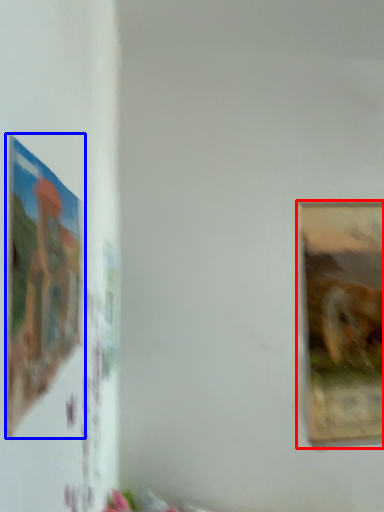
Question: Which object is further to the camera taking this photo, picture frame (highlighted by a red box) or picture frame (highlighted by a blue box)?

Choices:
 (A) picture frame
 (B) picture frame

Answer: (A)